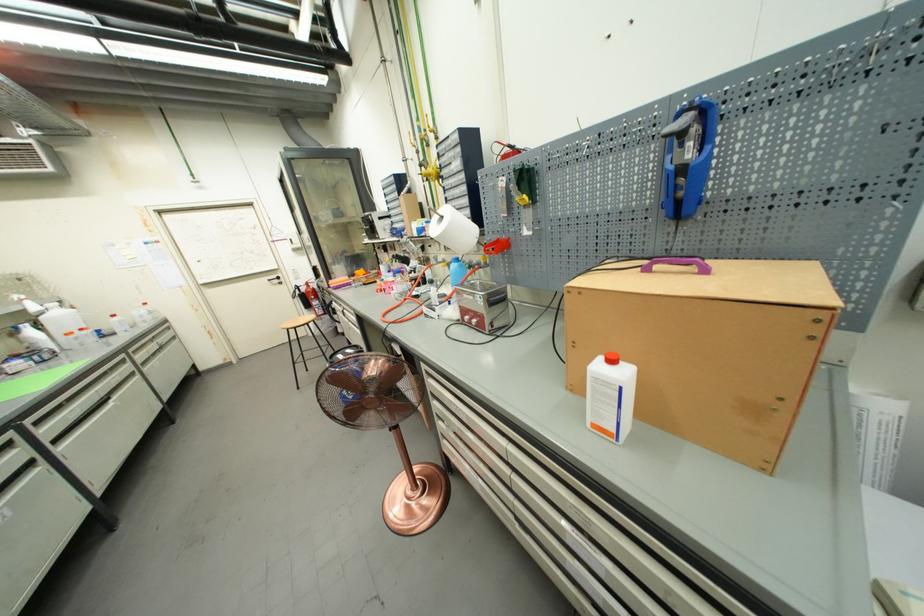
Describe the element at coordinates (496, 246) in the screenshot. I see `the red clamp handle` at that location.